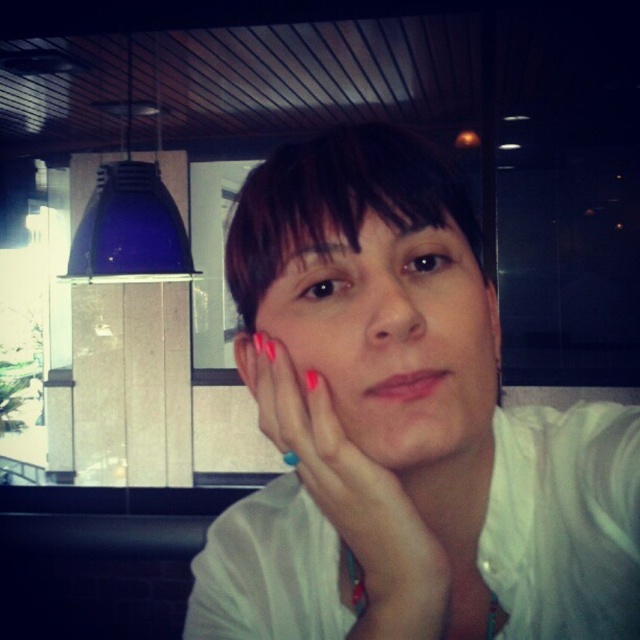
You are a fashion designer observing the image. You need to determine which item takes up more visual space in the composition. Which object is larger in size between the white matte shirt at center and the pink nail polish at center?

The white matte shirt at center is larger in size than the pink nail polish at center, so it takes up more visual space in the composition.